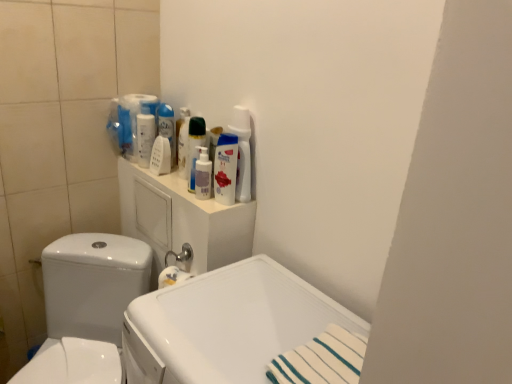
In order to click on blank space situated above white glossy sink at center (from a real-world perspective) in this screenshot , I will do `click(247, 310)`.